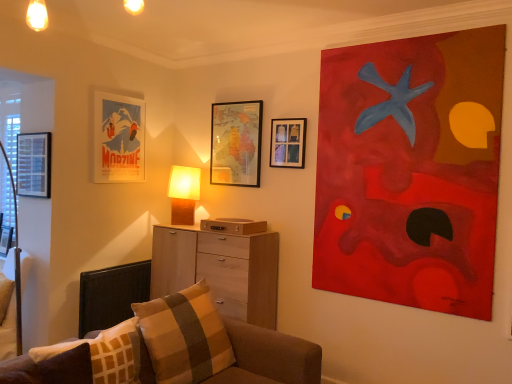
Question: Does point (96, 168) appear closer or farther from the camera than point (147, 266)?

Choices:
 (A) farther
 (B) closer

Answer: (B)

Question: From a real-world perspective, is matte paper poster at upper left, arranged as the fourth picture frame when viewed from the right, physically located above or below black fabric swivel chair at lower left?

Choices:
 (A) above
 (B) below

Answer: (A)

Question: Which of these objects is positioned closest to the plaid fabric pillow at lower center, the first pillow from the back?

Choices:
 (A) matte wooden picture frame at upper center, the 2th picture frame in the right-to-left sequence
 (B) metallic silver picture frame at left, positioned as the sixth picture frame in right-to-left order
 (C) matte black picture frame at left, the 2th picture frame viewed from the left
 (D) brown fabric couch at lower right
 (E) wooden map at upper center, acting as the third picture frame starting from the right

Answer: (D)

Question: Considering the real-world distances, which object is closest to the brown fabric couch at lower right?

Choices:
 (A) wooden map at upper center, acting as the 4th picture frame starting from the left
 (B) brown plaid pillow at lower left, which is the second pillow from back to front
 (C) light wood chest of drawers at center
 (D) matte paper poster at upper left, which is counted as the 3th picture frame, starting from the left
 (E) plaid fabric pillow at lower center, the first pillow from the back

Answer: (E)